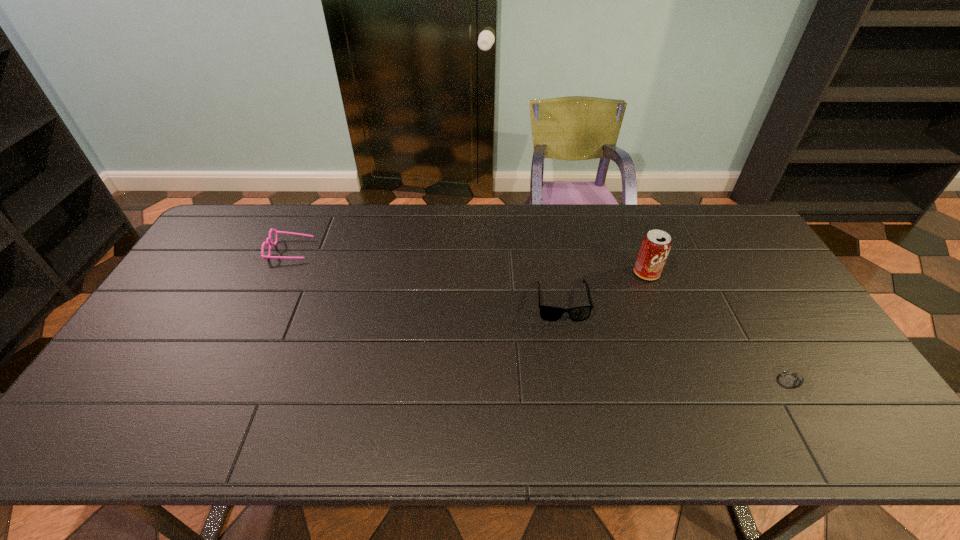
This screenshot has width=960, height=540. I want to click on the tallest object, so click(655, 247).

Find the location of `soda can`. soda can is located at coordinates 655,247.

The width and height of the screenshot is (960, 540). In order to click on the third object from right to left in this screenshot , I will do `click(548, 313)`.

This screenshot has height=540, width=960. What are the coordinates of `spectacles` in the screenshot? It's located at (268, 240).

Locate an element on the screen. The image size is (960, 540). the leftmost object is located at coordinates (268, 240).

Locate an element on the screen. This screenshot has height=540, width=960. watch is located at coordinates (791, 379).

Where is `the rightmost object`? This screenshot has width=960, height=540. the rightmost object is located at coordinates (791, 379).

Locate an element on the screen. This screenshot has height=540, width=960. vacant space positioned on the right of the second object from right to left is located at coordinates (772, 273).

You are a GUI agent. You are given a task and a screenshot of the screen. Output one action in this format:
    pyautogui.click(x=<x>, y=<y>)
    Task: Click on the free region located on the front-facing side of the sunglasses
    
    Given the screenshot: What is the action you would take?
    pyautogui.click(x=571, y=356)

This screenshot has width=960, height=540. In order to click on vacant space situated on the arms of the spectacles in this screenshot , I will do `click(335, 250)`.